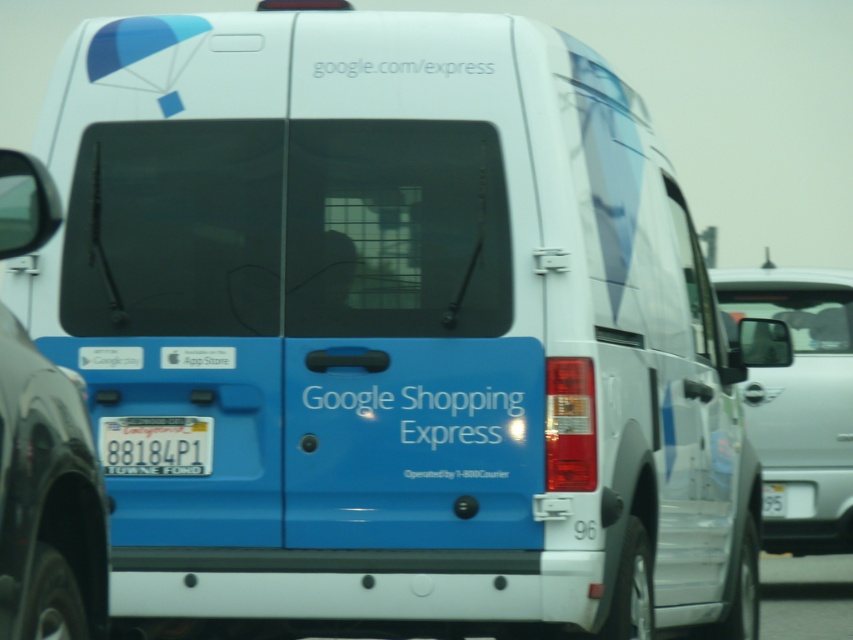
Question: From the image, what is the correct spatial relationship of silver metallic van at right in relation to yellow matte license plate at lower center?

Choices:
 (A) below
 (B) above

Answer: (A)

Question: Which object appears farthest from the camera in this image?

Choices:
 (A) yellow matte license plate at lower center
 (B) silver metallic van at right

Answer: (B)

Question: Observing the image, what is the correct spatial positioning of silver metallic van at right in reference to yellow matte license plate at lower center?

Choices:
 (A) below
 (B) above

Answer: (A)

Question: Does silver metallic van at right have a smaller size compared to yellow matte license plate at lower center?

Choices:
 (A) yes
 (B) no

Answer: (B)

Question: Which object is closer to the camera taking this photo?

Choices:
 (A) silver metallic van at right
 (B) yellow matte license plate at lower center

Answer: (B)